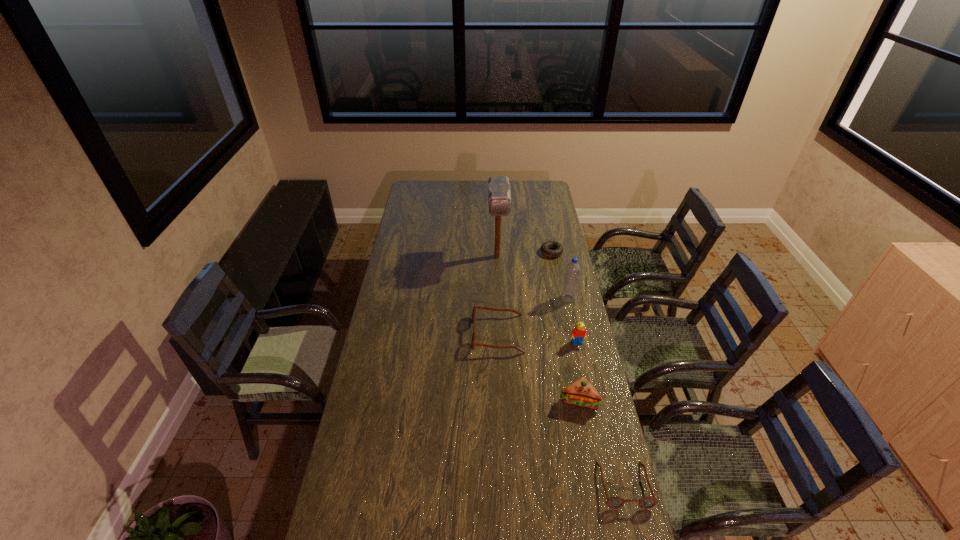
Where is `the farther spectacles`? This screenshot has width=960, height=540. the farther spectacles is located at coordinates (473, 344).

Find the location of a particular element. The height and width of the screenshot is (540, 960). the left spectacles is located at coordinates (473, 344).

Find the location of a particular element. The width and height of the screenshot is (960, 540). the second shortest object is located at coordinates (616, 502).

Identify the location of the nearest object. Image resolution: width=960 pixels, height=540 pixels. (616, 502).

Identify the location of the shortest object. (546, 247).

You are a GUI agent. You are given a task and a screenshot of the screen. Output one action in this format:
    pyautogui.click(x=<x>, y=<y>)
    Task: Click on the tallest object
    The height and width of the screenshot is (540, 960).
    Given the screenshot: What is the action you would take?
    pos(499,198)

Find the location of a particular element. Image resolution: width=960 pixels, height=540 pixels. the second nearest object is located at coordinates (581, 393).

Where is `the fifth nearest object`? The image size is (960, 540). the fifth nearest object is located at coordinates (573, 268).

This screenshot has height=540, width=960. I want to click on the second tallest object, so pos(573,268).

The width and height of the screenshot is (960, 540). Identify the location of Lego. tap(579, 332).